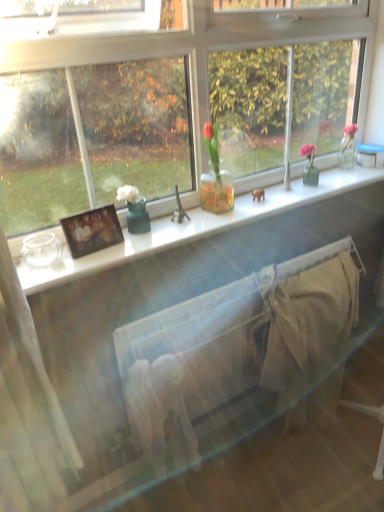
Identify the location of free location in front of matte wooden picture frame at left. (79, 265).